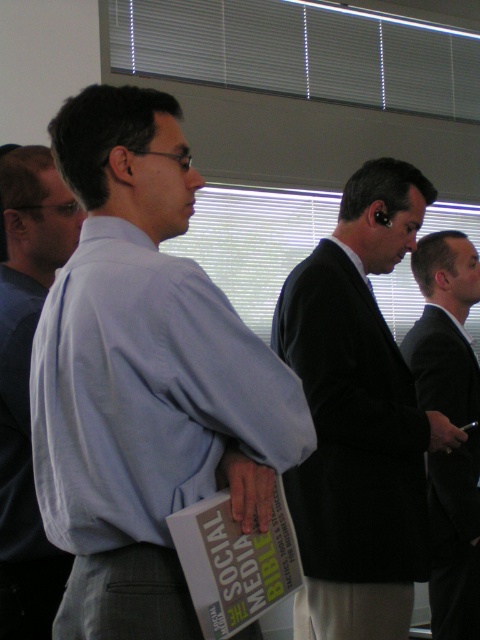
Is point (69, 410) positioned behind point (325, 285)?

No, it is not.

Can you confirm if light blue shirt at center is smaller than dark suit at center?

Yes, light blue shirt at center is smaller than dark suit at center.

This screenshot has width=480, height=640. Find the location of `light blue shirt at center`. light blue shirt at center is located at coordinates (144, 378).

Which of these two, dark suit at center or black suit at right, stands taller?

dark suit at center

Does point (365, 419) come behind point (474, 252)?

No, (365, 419) is closer to viewer.

This screenshot has width=480, height=640. What are the coordinates of `dark suit at center` in the screenshot? It's located at (359, 417).

From the picture: How much distance is there between light blue shirt at center and white plastic blinds at upper center?

A distance of 2.66 meters exists between light blue shirt at center and white plastic blinds at upper center.

Does light blue shirt at center have a lesser width compared to white plastic blinds at upper center?

Correct, light blue shirt at center's width is less than white plastic blinds at upper center's.

Who is more forward, [80,496] or [222,36]?

Positioned in front is point [80,496].

Where is `light blue shirt at center`? Image resolution: width=480 pixels, height=640 pixels. light blue shirt at center is located at coordinates (144, 378).